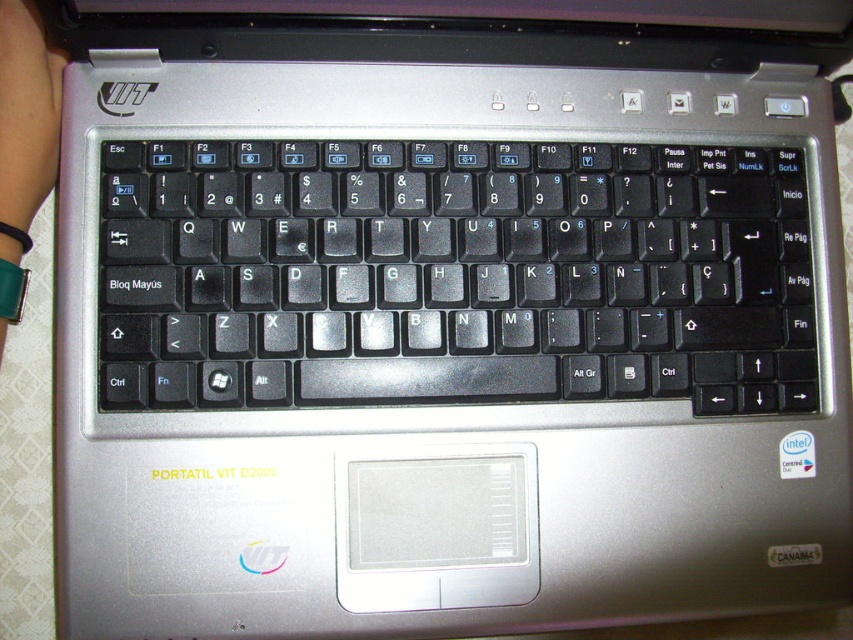
Who is higher up, black plastic keyboard at center or green leather wristband at lower left?

green leather wristband at lower left is above.

Which of these two, black plastic keyboard at center or green leather wristband at lower left, stands shorter?

With less height is black plastic keyboard at center.

The height and width of the screenshot is (640, 853). Describe the element at coordinates (453, 275) in the screenshot. I see `black plastic keyboard at center` at that location.

Locate an element on the screen. black plastic keyboard at center is located at coordinates (453, 275).